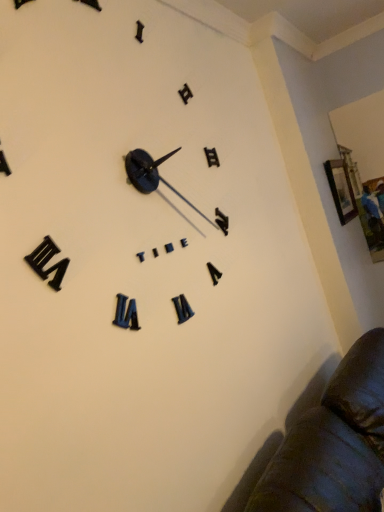
In order to face black matte clock at upper center, should I rotate leftwards or rightwards?

Turn left approximately 6.421 degrees to face it.

What do you see at coordinates (132, 214) in the screenshot? I see `black matte clock at upper center` at bounding box center [132, 214].

At what (x,y) coordinates should I click in order to perform the action: click on black matte clock at upper center. Please return your answer as a coordinate pair (x, y). The width and height of the screenshot is (384, 512). Looking at the image, I should click on (132, 214).

This screenshot has height=512, width=384. Describe the element at coordinates (341, 189) in the screenshot. I see `wooden picture frame at upper right` at that location.

You are a GUI agent. You are given a task and a screenshot of the screen. Output one action in this format:
    pyautogui.click(x=<x>, y=<y>)
    Task: Click on the wooden picture frame at upper right
    This screenshot has height=512, width=384.
    Given the screenshot: What is the action you would take?
    pyautogui.click(x=341, y=189)

The width and height of the screenshot is (384, 512). In order to click on black matte clock at upper center in this screenshot , I will do `click(132, 214)`.

Between black matte clock at upper center and wooden picture frame at upper right, which one appears on the left side from the viewer's perspective?

From the viewer's perspective, black matte clock at upper center appears more on the left side.

Which is in front, black matte clock at upper center or wooden picture frame at upper right?

black matte clock at upper center is more forward.

Between point (211, 347) and point (339, 168), which one is positioned in front?

The point (211, 347) is closer to the camera.

From the image's perspective, would you say black matte clock at upper center is shown under wooden picture frame at upper right?

Indeed, from the image's perspective, black matte clock at upper center is shown beneath wooden picture frame at upper right.

From a real-world perspective, who is located higher, black matte clock at upper center or wooden picture frame at upper right?

black matte clock at upper center, from a real-world perspective.

Does black matte clock at upper center have a greater width compared to wooden picture frame at upper right?

Correct, the width of black matte clock at upper center exceeds that of wooden picture frame at upper right.

Considering the relative sizes of black matte clock at upper center and wooden picture frame at upper right in the image provided, is black matte clock at upper center shorter than wooden picture frame at upper right?

No, black matte clock at upper center is not shorter than wooden picture frame at upper right.

Based on their sizes in the image, would you say black matte clock at upper center is bigger or smaller than wooden picture frame at upper right?

In the image, black matte clock at upper center appears to be larger than wooden picture frame at upper right.

Is wooden picture frame at upper right a part of black matte clock at upper center?

Definitely not — wooden picture frame at upper right is not inside black matte clock at upper center.

Based on the photo, is black matte clock at upper center with wooden picture frame at upper right?

black matte clock at upper center and wooden picture frame at upper right are clearly separated.

Is black matte clock at upper center positioned with its back to wooden picture frame at upper right?

No, black matte clock at upper center's orientation is not away from wooden picture frame at upper right.

This screenshot has width=384, height=512. In the image, there is a wooden picture frame at upper right. Identify the location of clock below it (from the image's perspective). (132, 214).

Is wooden picture frame at upper right to the left or to the right of black matte clock at upper center in the image?

wooden picture frame at upper right is positioned on black matte clock at upper center's right side.

Considering the positions of objects wooden picture frame at upper right and black matte clock at upper center in the image provided, who is in front, wooden picture frame at upper right or black matte clock at upper center?

black matte clock at upper center is more forward.

Considering the positions of point (335, 173) and point (22, 170), is point (335, 173) closer or farther from the camera than point (22, 170)?

Clearly, point (335, 173) is more distant from the camera than point (22, 170).

From the image's perspective, is wooden picture frame at upper right below black matte clock at upper center?

No.

From a real-world perspective, is wooden picture frame at upper right physically below black matte clock at upper center?

Yes, from a real-world perspective, wooden picture frame at upper right is below black matte clock at upper center.

Can you confirm if wooden picture frame at upper right is thinner than black matte clock at upper center?

Indeed, wooden picture frame at upper right has a lesser width compared to black matte clock at upper center.

Who is shorter, wooden picture frame at upper right or black matte clock at upper center?

wooden picture frame at upper right is shorter.

Which of these two, wooden picture frame at upper right or black matte clock at upper center, is smaller?

wooden picture frame at upper right.

Would you say wooden picture frame at upper right is inside or outside black matte clock at upper center?

wooden picture frame at upper right is not inside black matte clock at upper center, it's outside.

Would you say wooden picture frame at upper right is a long distance from black matte clock at upper center?

That's right, there is a large distance between wooden picture frame at upper right and black matte clock at upper center.

Could you tell me if wooden picture frame at upper right is turned towards black matte clock at upper center?

No, wooden picture frame at upper right is not aimed at black matte clock at upper center.

Measure the distance from wooden picture frame at upper right to black matte clock at upper center.

wooden picture frame at upper right and black matte clock at upper center are 5.05 feet apart.

Locate an element on the screen. This screenshot has height=512, width=384. clock on the left of wooden picture frame at upper right is located at coordinates (132, 214).

Where is `clock in front of the wooden picture frame at upper right`? The height and width of the screenshot is (512, 384). clock in front of the wooden picture frame at upper right is located at coordinates 132,214.

Locate an element on the screen. The height and width of the screenshot is (512, 384). clock below the wooden picture frame at upper right (from the image's perspective) is located at coordinates (132, 214).